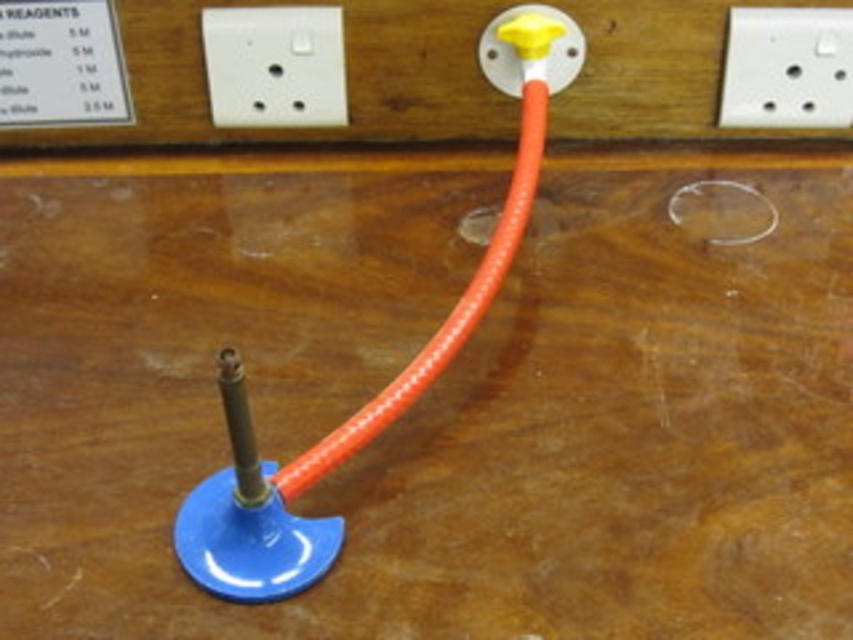
You are an electrician working in this lab and need to connect a cable that is 12 inches long between the two white plastic sockets. Will the cable be long enough to reach between the white plastic socket at upper center and the white plastic socket at upper right?

The distance between the white plastic socket at upper center and the white plastic socket at upper right is 13.57 inches. Since the cable is only 12 inches long, it will not be long enough to reach between them.

You are an electrician inspecting the equipment in the laboratory. You notice the white plastic socket at upper right and the yellow plastic knob at upper center. Which of these two components has a greater width?

The white plastic socket at upper right has a greater width than the yellow plastic knob at upper center according to the description.